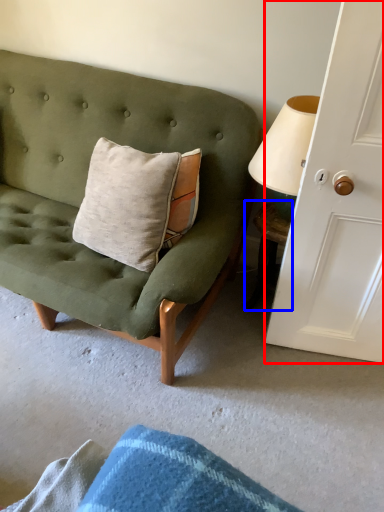
Question: Among these objects, which one is farthest to the camera, door (highlighted by a red box) or table (highlighted by a blue box)?

Choices:
 (A) door
 (B) table

Answer: (B)